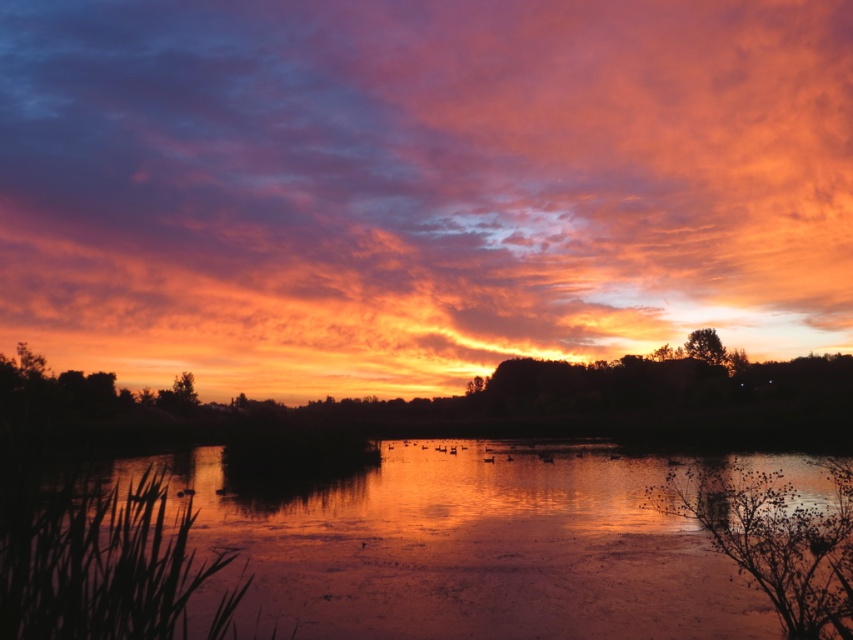
You are standing at the camera position observing the serene sunset scene. There is a point marked at coordinates point (497,109). Can you reach that point by walking straight ahead without deviating from your path?

The point (497,109) is 146.75 meters away from the camera. Since it is a straight line distance, you can walk straight ahead and reach it without deviating from your path.

You are an artist planning to paint this sunset scene. You want to ensure the matte orange cloud at upper center and the glossy water at center are proportionally accurate. Which object should you paint first to maintain the correct size relationship?

You should paint the glossy water at center first because the matte orange cloud at upper center is wider, so starting with the smaller glossy water at center allows you to scale the matte orange cloud at upper center appropriately.